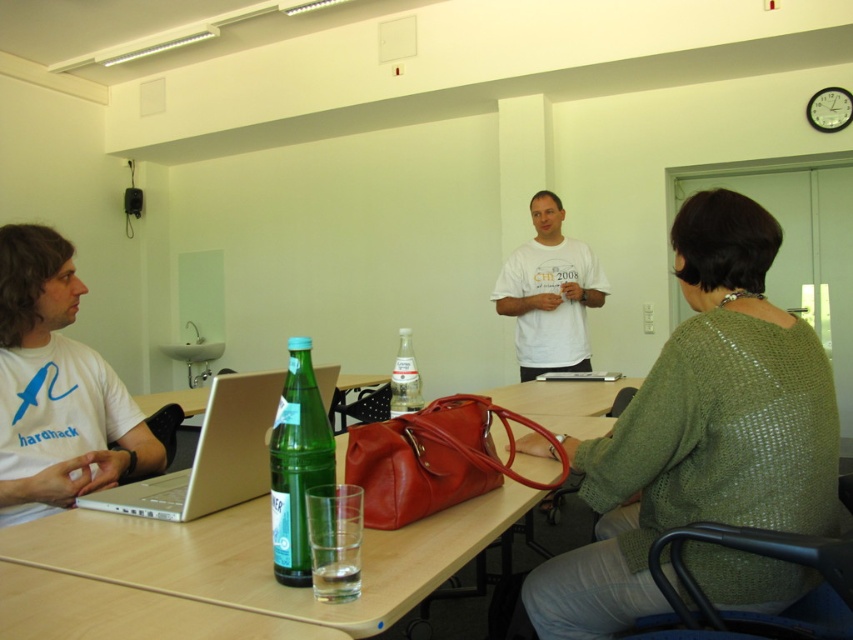
You are organizing a presentation and need to place a name tag between the silver metallic laptop at left and the green glass bottle at center. Since the laptop is wider, will the name tag fit between them without overlapping either item?

The silver metallic laptop at left is wider than the green glass bottle at center. Therefore, placing a name tag between them should be possible as long as it is narrower than the space between the edges of both objects.

You are trying to locate the silver metallic laptop at left in the image. What are the coordinates where it can be found?

The silver metallic laptop at left is located at coordinates point (210, 456).

You are organizing a presentation and need to place a name tag between the silver metallic laptop at left and the green glass bottle at center. Since the laptop is shorter than the bottle, where should you position the name tag to ensure it is visible to both participants?

The silver metallic laptop at left is not as tall as the green glass bottle at center, so positioning the name tag between them at a height level with the laptop would ensure visibility over the laptop and around the bottle.